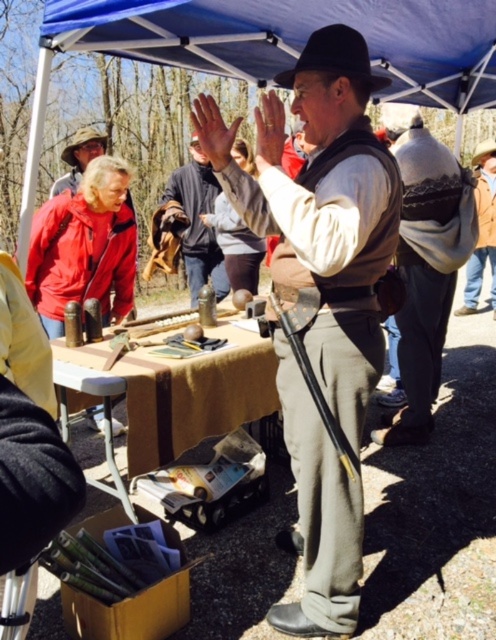
Between leather gloves at center and smooth skin hand at center, which one is positioned higher?

leather gloves at center is above.

Who is taller, leather gloves at center or smooth skin hand at center?

leather gloves at center is taller.

Is point (180, 200) positioned before point (261, 140)?

No.

At what (x,y) coordinates should I click in order to perform the action: click on leather gloves at center. Please return your answer as a coordinate pair (x, y). The width and height of the screenshot is (496, 640). Looking at the image, I should click on (195, 221).

Which is more to the right, matte brown vest at center or knitted wool sweater at center?

knitted wool sweater at center

Who is positioned more to the left, matte brown vest at center or knitted wool sweater at center?

matte brown vest at center

This screenshot has width=496, height=640. Describe the element at coordinates (330, 221) in the screenshot. I see `matte brown vest at center` at that location.

What are the coordinates of `matte brown vest at center` in the screenshot? It's located at (330, 221).

Measure the distance from matte brown vest at center to matte skin hand at center.

A distance of 28.30 inches exists between matte brown vest at center and matte skin hand at center.

Does point (306, 241) come farther from viewer compared to point (223, 140)?

No, (306, 241) is in front of (223, 140).

The image size is (496, 640). I want to click on matte brown vest at center, so click(330, 221).